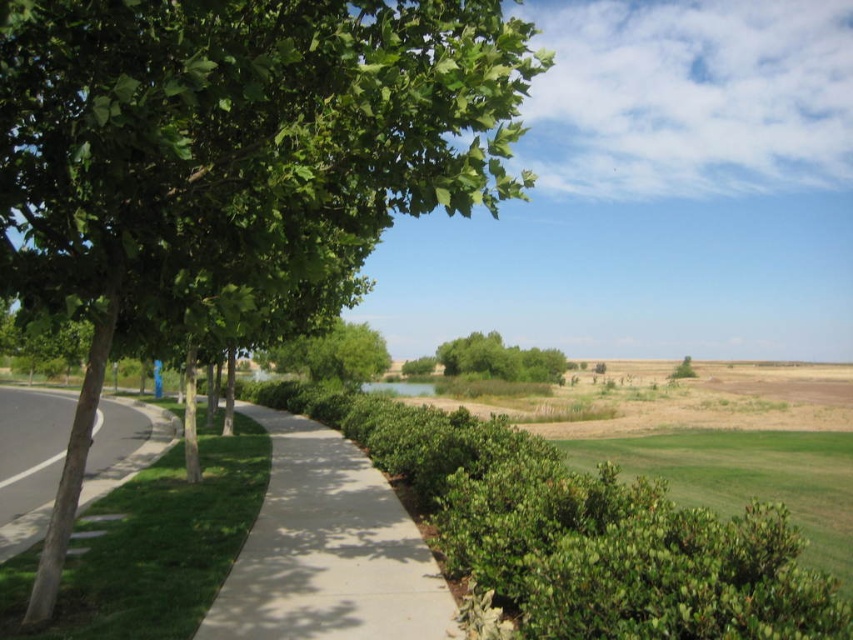
From the picture: You are a gardener planning to plant a new flower bed between the green leafy tree at left and the green soft grass at left. Based on their positions, which side of the pathway should you choose to place the flower bed?

The green leafy tree at left is to the right of the green soft grass at left, so the flower bed should be placed on the left side of the pathway between them.

You are a gardener planning to plant a new tree in this outdoor area. You have a small garden cart that can carry either the green leafy bush at center or the green leafy tree at center. Which object should you choose to transport if you want to move the larger one?

The green leafy bush at center has a larger size compared to the green leafy tree at center, so you should choose to transport the green leafy bush at center.

You are a gardener who wants to plant a new flower bed between the green leafy tree at left and the green soft grass at left. Which object is shorter so that the flowers can grow without being overshadowed?

The green leafy tree at left has a lesser height compared to the green soft grass at left, so planting the flower bed near the green leafy tree at left would ensure the flowers are not overshadowed.